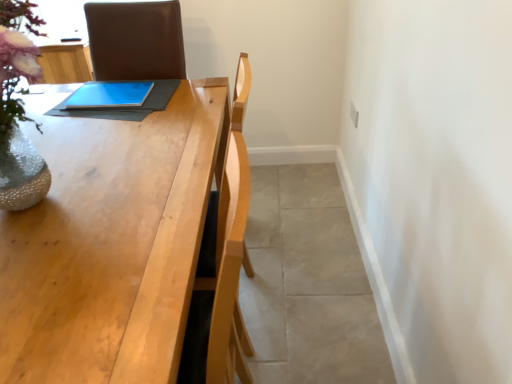
Identify the location of vacant space behind blue matte tablet at center. (116, 86).